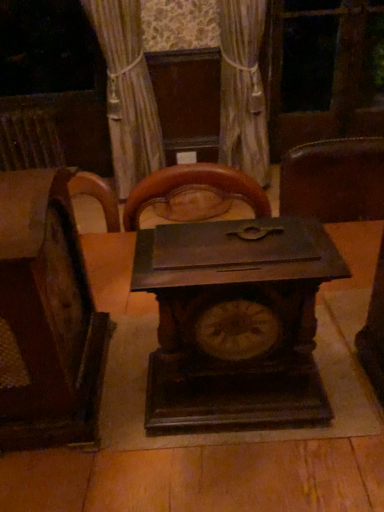
In order to click on vacant point to the right of dark brown wood clock at center in this screenshot , I will do `click(344, 376)`.